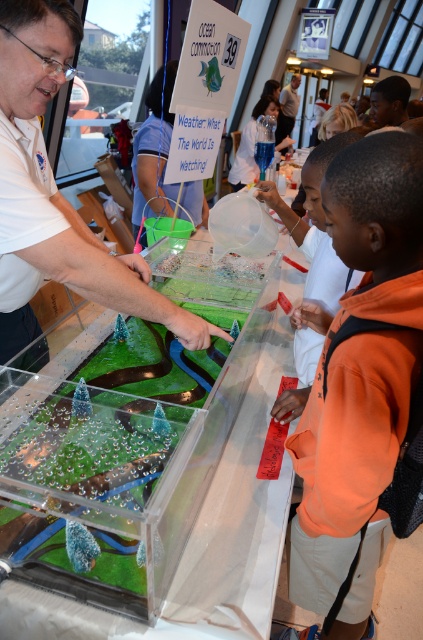
Question: Can you confirm if orange fleece jacket at right is wider than orange fleece jacket at lower right?

Choices:
 (A) no
 (B) yes

Answer: (A)

Question: Does orange fleece jacket at right have a lesser width compared to matte white shirt at upper center?

Choices:
 (A) yes
 (B) no

Answer: (A)

Question: Which is farther from the matte white shirt at left?

Choices:
 (A) orange fleece jacket at lower right
 (B) orange fleece jacket at right
 (C) matte white shirt at upper center

Answer: (C)

Question: Does orange fleece jacket at right appear on the right side of matte white shirt at left?

Choices:
 (A) no
 (B) yes

Answer: (B)

Question: Which point is closer to the camera?

Choices:
 (A) (373, 388)
 (B) (291, 112)
 (C) (313, 339)

Answer: (A)

Question: Which point is farther from the camera taking this photo?

Choices:
 (A) (x=365, y=292)
 (B) (x=283, y=100)

Answer: (B)